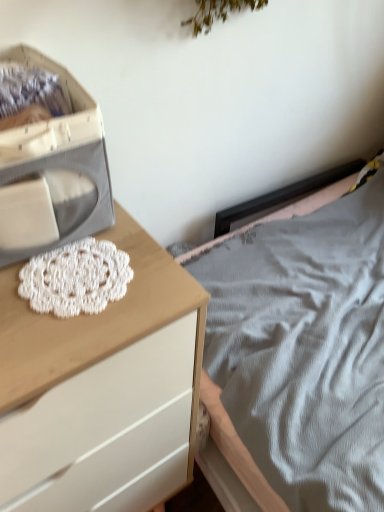
The image size is (384, 512). What are the coordinates of `free spot to the right of white crochet doily at center-left` in the screenshot? It's located at click(x=156, y=287).